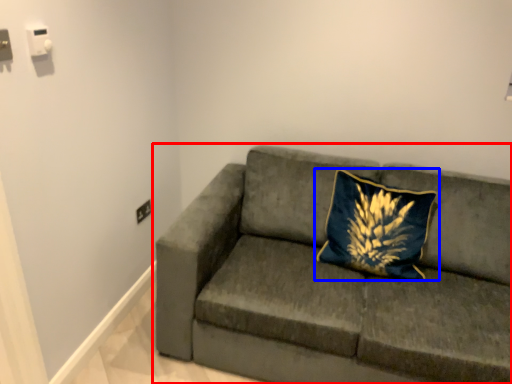
Question: Which object is further to the camera taking this photo, studio couch (highlighted by a red box) or pillow (highlighted by a blue box)?

Choices:
 (A) studio couch
 (B) pillow

Answer: (B)